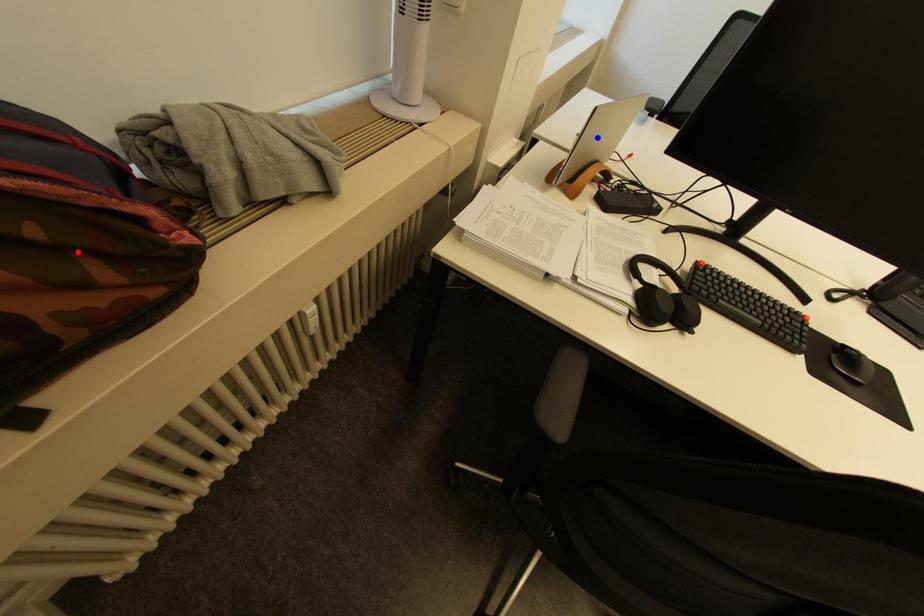
Question: In the image, two points are highlighted. Which point is nearer to the camera? Reply with the corresponding letter.

Choices:
 (A) blue point
 (B) red point

Answer: (B)